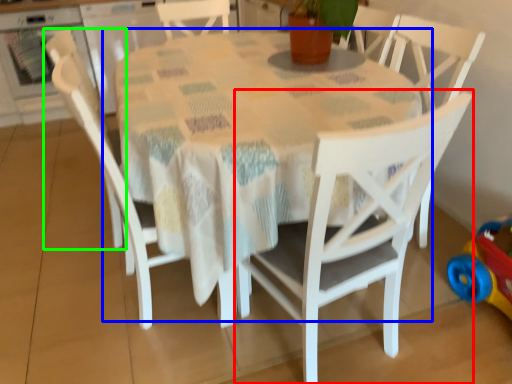
Question: Estimate the real-world distances between objects in this image. Which object is farther from chair (highlighted by a red box), table (highlighted by a blue box) or chair (highlighted by a green box)?

Choices:
 (A) table
 (B) chair

Answer: (B)